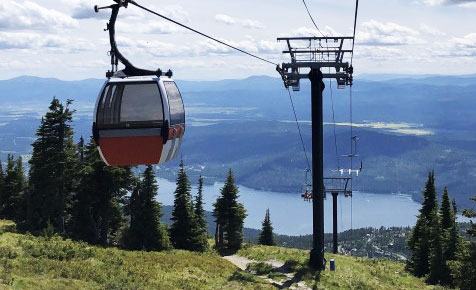
This screenshot has height=290, width=476. I want to click on handle, so click(x=176, y=136).